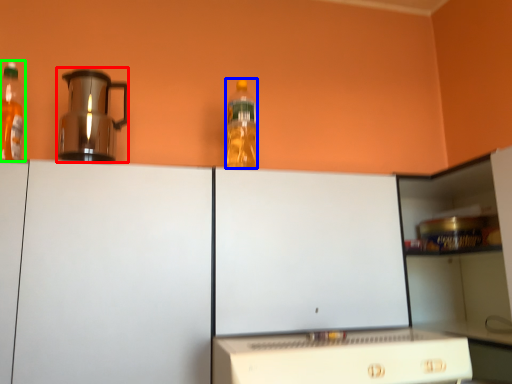
Question: Which object is the farthest from kitchen appliance (highlighted by a red box)? Choose among these: bottle (highlighted by a blue box) or bottle (highlighted by a green box).

Choices:
 (A) bottle
 (B) bottle

Answer: (A)